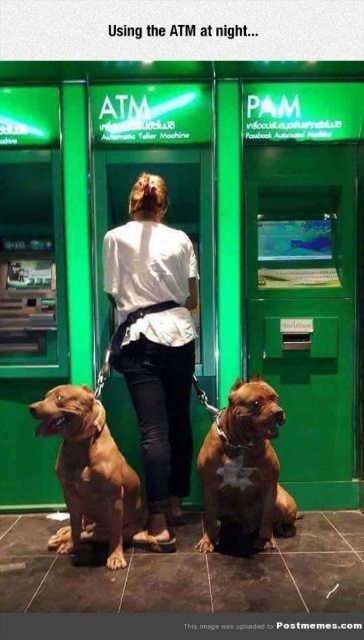
Question: Is white matte shirt at center above brown leather dog at center?

Choices:
 (A) no
 (B) yes

Answer: (B)

Question: Which point is closer to the camera taking this photo?

Choices:
 (A) (108, 240)
 (B) (81, 392)

Answer: (B)

Question: Where is white matte shirt at center located in relation to brown shiny fur at lower center in the image?

Choices:
 (A) left
 (B) right

Answer: (B)

Question: Which object appears farthest from the camera in this image?

Choices:
 (A) brown shiny fur at lower center
 (B) brown leather dog at center
 (C) white matte shirt at center

Answer: (C)

Question: Based on their relative distances, which object is farther from the brown leather dog at center?

Choices:
 (A) white matte shirt at center
 (B) brown shiny fur at lower center

Answer: (B)

Question: Is brown shiny fur at lower center positioned before brown leather dog at center?

Choices:
 (A) no
 (B) yes

Answer: (A)